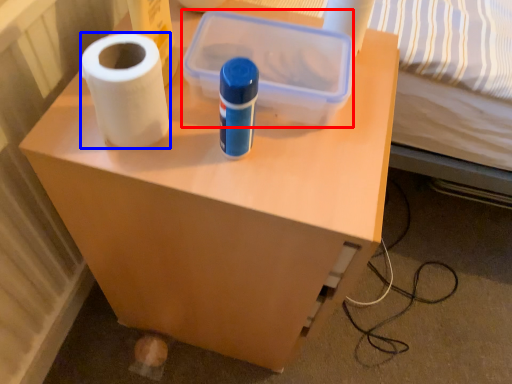
Question: Which object is closer to the camera taking this photo, storage box (highlighted by a red box) or paper towel (highlighted by a blue box)?

Choices:
 (A) storage box
 (B) paper towel

Answer: (B)